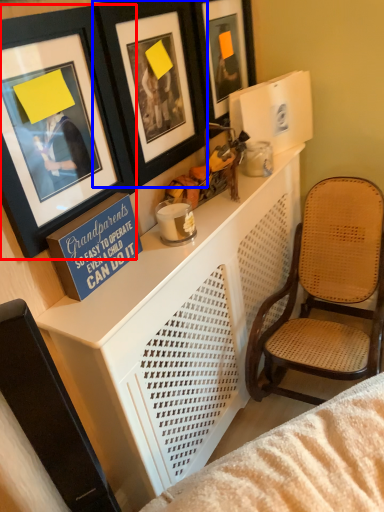
Question: Which point is closer to the camera, picture frame (highlighted by a red box) or picture frame (highlighted by a blue box)?

Choices:
 (A) picture frame
 (B) picture frame

Answer: (A)